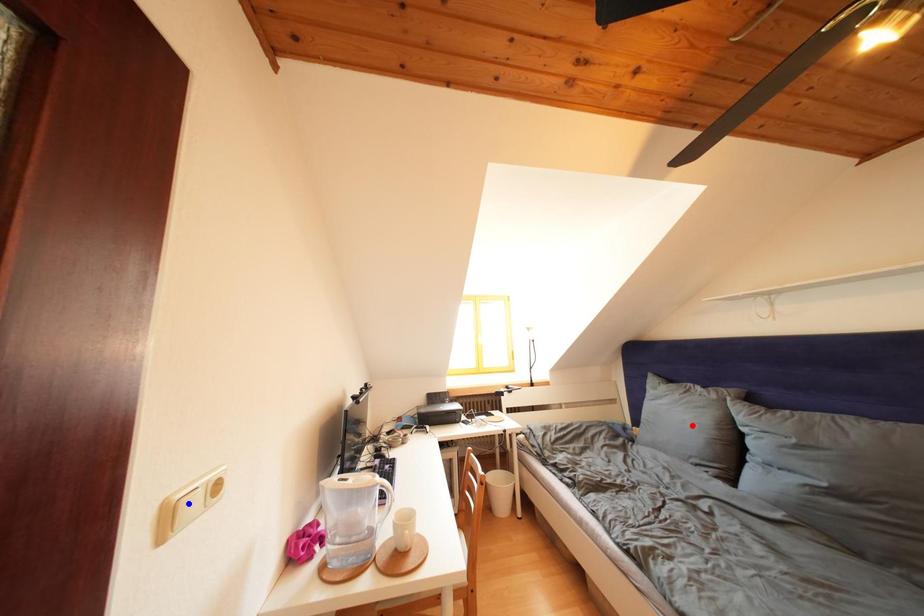
Question: Which of the two points in the image is closer to the camera?

Choices:
 (A) Blue point is closer.
 (B) Red point is closer.

Answer: (A)